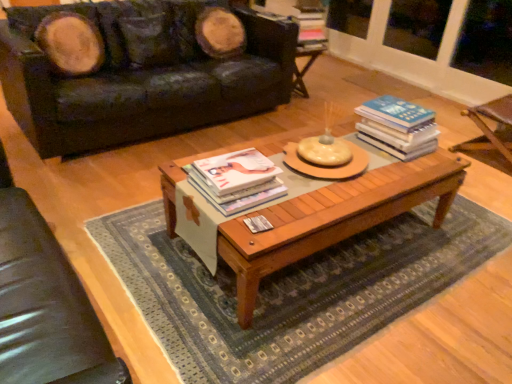
What is the approximate height of wooden armchair at right, marked as the second armchair in a front-to-back arrangement?

It is 39.79 centimeters.

Describe the element at coordinates (333, 218) in the screenshot. I see `wooden coffee table at center` at that location.

Measure the distance between point (280, 189) and camera.

Point (280, 189) is 5.66 feet from camera.

This screenshot has height=384, width=512. What do you see at coordinates (236, 179) in the screenshot?
I see `matte white book at center, arranged as the first book when viewed from the front` at bounding box center [236, 179].

The width and height of the screenshot is (512, 384). What do you see at coordinates (291, 290) in the screenshot?
I see `wooden coffee table at center` at bounding box center [291, 290].

I want to click on leather couch at upper left, so click(x=141, y=75).

Is point (503, 132) closer or farther from the camera than point (414, 161)?

Point (503, 132) is farther from the camera than point (414, 161).

Between wooden armchair at right, marked as the second armchair in a front-to-back arrangement, and wooden coffee table at center, which one has larger size?

wooden coffee table at center is bigger.

Considering the sizes of wooden armchair at right, which ranks as the 2th armchair in left-to-right order, and wooden coffee table at center in the image, is wooden armchair at right, which ranks as the 2th armchair in left-to-right order, taller or shorter than wooden coffee table at center?

In the image, wooden armchair at right, which ranks as the 2th armchair in left-to-right order, appears to be shorter than wooden coffee table at center.

How many degrees apart are the facing directions of wooden armchair at right, the 1th armchair in the back-to-front sequence, and wooden coffee table at center?

90.1 degrees.

Is matte white book at center, arranged as the second book when viewed from the top, wider than wooden armchair at right, which ranks as the 2th armchair in left-to-right order?

In fact, matte white book at center, arranged as the second book when viewed from the top, might be narrower than wooden armchair at right, which ranks as the 2th armchair in left-to-right order.

Between matte white book at center, arranged as the first book when viewed from the front, and wooden armchair at right, the 1th armchair in the back-to-front sequence, which one has smaller size?

matte white book at center, arranged as the first book when viewed from the front.

From a real-world perspective, which is physically above, matte white book at center, the 2th book in the right-to-left sequence, or wooden armchair at right, positioned as the 1th armchair in right-to-left order?

matte white book at center, the 2th book in the right-to-left sequence.

Which object is wider, wooden coffee table at center or leather couch at upper left?

leather couch at upper left is wider.

Is wooden coffee table at center in contact with leather couch at upper left?

No, wooden coffee table at center is not beside leather couch at upper left.

Considering the relative positions of wooden coffee table at center and leather couch at upper left in the image provided, is wooden coffee table at center to the left of leather couch at upper left from the viewer's perspective?

In fact, wooden coffee table at center is to the right of leather couch at upper left.

Can you tell me how much hardcover book at center, which is the 2th book in bottom-to-top order, and wooden coffee table at center differ in facing direction?

hardcover book at center, which is the 2th book in bottom-to-top order, and wooden coffee table at center are facing 180 degrees away from each other.

Based on the photo, is hardcover book at center, which is the 2th book in bottom-to-top order, next to wooden coffee table at center and touching it?

There is a gap between hardcover book at center, which is the 2th book in bottom-to-top order, and wooden coffee table at center.

Considering the sizes of hardcover book at center, the 2th book positioned from the left, and wooden coffee table at center in the image, is hardcover book at center, the 2th book positioned from the left, bigger or smaller than wooden coffee table at center?

hardcover book at center, the 2th book positioned from the left, is smaller than wooden coffee table at center.

From their relative heights in the image, would you say hardcover book at center, arranged as the first book when viewed from the top, is taller or shorter than wooden coffee table at center?

Considering their sizes, hardcover book at center, arranged as the first book when viewed from the top, has less height than wooden coffee table at center.

The image size is (512, 384). I want to click on armchair that appears below the hardcover book at center, the 2th book positioned from the left (from the image's perspective), so click(45, 304).

Does hardcover book at center, which appears as the first book when viewed from the right, have a larger size compared to leather armchair at left, which ranks as the 2th armchair in right-to-left order?

Incorrect, hardcover book at center, which appears as the first book when viewed from the right, is not larger than leather armchair at left, which ranks as the 2th armchair in right-to-left order.

Is hardcover book at center, which is the second book in front-to-back order, not inside leather armchair at left, which is counted as the 1th armchair, starting from the front?

Yes, hardcover book at center, which is the second book in front-to-back order, is outside of leather armchair at left, which is counted as the 1th armchair, starting from the front.

In terms of size, does leather couch at upper left appear bigger or smaller than hardcover book at center, which is the second book in front-to-back order?

leather couch at upper left is bigger than hardcover book at center, which is the second book in front-to-back order.

From the image's perspective, is leather couch at upper left beneath hardcover book at center, which is the 2th book in bottom-to-top order?

Actually, leather couch at upper left appears above hardcover book at center, which is the 2th book in bottom-to-top order, in the image.

What's the angular difference between leather couch at upper left and hardcover book at center, arranged as the first book when viewed from the top,'s facing directions?

178 degrees separate the facing orientations of leather couch at upper left and hardcover book at center, arranged as the first book when viewed from the top.

Image resolution: width=512 pixels, height=384 pixels. In order to click on studio couch that appears on the left of hardcover book at center, which is the second book in front-to-back order in this screenshot , I will do `click(141, 75)`.

Which is behind, point (394, 155) or point (488, 148)?

The point (488, 148) is farther.

Is hardcover book at center, the 2th book positioned from the left, turned away from wooden armchair at right, the 1th armchair in the back-to-front sequence?

No, hardcover book at center, the 2th book positioned from the left, is not facing away from wooden armchair at right, the 1th armchair in the back-to-front sequence.

In the scene shown: In the image, is hardcover book at center, arranged as the first book when viewed from the top, positioned in front of or behind wooden armchair at right, marked as the second armchair in a front-to-back arrangement?

hardcover book at center, arranged as the first book when viewed from the top, is positioned closer to the viewer than wooden armchair at right, marked as the second armchair in a front-to-back arrangement.

Considering the relative sizes of hardcover book at center, which is the second book in front-to-back order, and wooden armchair at right, marked as the second armchair in a front-to-back arrangement, in the image provided, is hardcover book at center, which is the second book in front-to-back order, smaller than wooden armchair at right, marked as the second armchair in a front-to-back arrangement,?

Indeed, hardcover book at center, which is the second book in front-to-back order, has a smaller size compared to wooden armchair at right, marked as the second armchair in a front-to-back arrangement.

The height and width of the screenshot is (384, 512). What are the coordinates of `armchair behind the wooden coffee table at center` in the screenshot? It's located at (489, 128).

From a real-world perspective, which book is the 1st one above the wooden armchair at right, which ranks as the 2th armchair in left-to-right order? Please provide its 2D coordinates.

[(236, 179)]

Considering their positions, is leather couch at upper left positioned closer to leather armchair at left, which is counted as the 1th armchair, starting from the front, than wooden coffee table at center?

The object closer to leather armchair at left, which is counted as the 1th armchair, starting from the front, is wooden coffee table at center.

Estimate the real-world distances between objects in this image. Which object is closer to hardcover book at center, arranged as the first book when viewed from the top, matte white book at center, which is counted as the first book, starting from the bottom, or wooden coffee table at center?

wooden coffee table at center is positioned closer to the anchor hardcover book at center, arranged as the first book when viewed from the top.

Looking at the image, which one is located closer to wooden coffee table at center, hardcover book at center, arranged as the first book when viewed from the top, or wooden coffee table at center?

wooden coffee table at center is closer to wooden coffee table at center.

Which object lies further to the anchor point hardcover book at center, which is the 2th book in bottom-to-top order, leather couch at upper left or wooden coffee table at center?

The object further to hardcover book at center, which is the 2th book in bottom-to-top order, is leather couch at upper left.

Which object lies nearer to the anchor point wooden coffee table at center, matte white book at center, arranged as the second book when viewed from the top, or wooden armchair at right, marked as the second armchair in a front-to-back arrangement?

Among the two, matte white book at center, arranged as the second book when viewed from the top, is located nearer to wooden coffee table at center.

Estimate the real-world distances between objects in this image. Which object is further from hardcover book at center, arranged as the first book when viewed from the top, wooden coffee table at center or matte white book at center, arranged as the first book when viewed from the front?

Based on the image, matte white book at center, arranged as the first book when viewed from the front, appears to be further to hardcover book at center, arranged as the first book when viewed from the top.

Which object lies further to the anchor point wooden coffee table at center, hardcover book at center, which is the 2th book in bottom-to-top order, or leather armchair at left, the first armchair from the left?

Among the two, leather armchair at left, the first armchair from the left, is located further to wooden coffee table at center.

Based on their spatial positions, is wooden armchair at right, the 1th armchair in the back-to-front sequence, or hardcover book at center, arranged as the first book when viewed from the top, closer to leather couch at upper left?

hardcover book at center, arranged as the first book when viewed from the top.

You are a GUI agent. You are given a task and a screenshot of the screen. Output one action in this format:
    pyautogui.click(x=<x>, y=<y>)
    Task: Click on the coffee table between leather couch at upper left and hardcover book at center, which is the second book in front-to-back order, from left to right
    
    Given the screenshot: What is the action you would take?
    pyautogui.click(x=333, y=218)

At what (x,y) coordinates should I click in order to perform the action: click on book between wooden coffee table at center and wooden armchair at right, positioned as the 1th armchair in right-to-left order. Please return your answer as a coordinate pair (x, y). Looking at the image, I should click on (398, 127).

Identify the location of mat between leather armchair at left, positioned as the 2th armchair in back-to-front order, and leather couch at upper left in the front-back direction. This screenshot has height=384, width=512. (291, 290).

This screenshot has height=384, width=512. Identify the location of mat situated between leather armchair at left, positioned as the 2th armchair in back-to-front order, and wooden armchair at right, positioned as the 1th armchair in right-to-left order, from left to right. (291, 290).